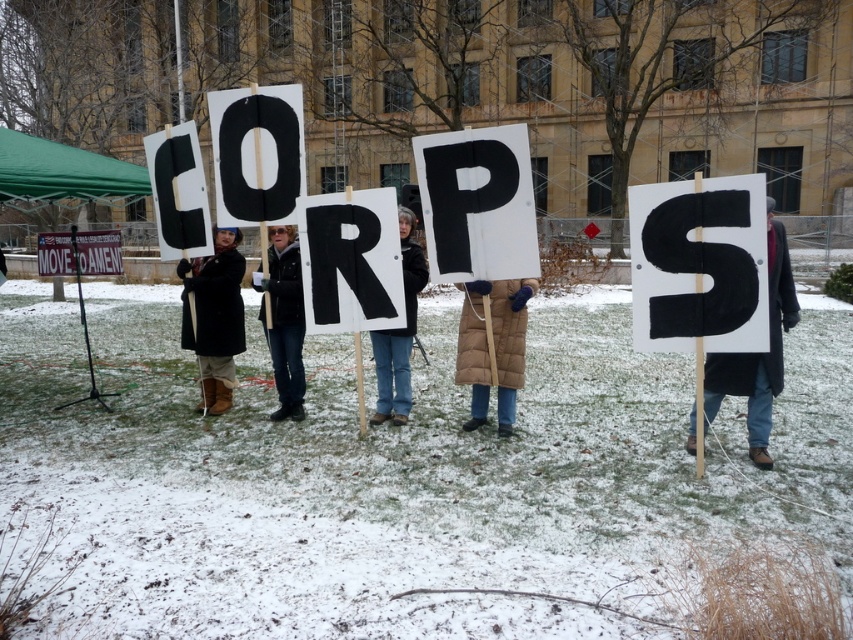
Does black cardboard letter o at center have a greater width compared to white cardboard sign at center?

No.

Can you confirm if black cardboard letter o at center is positioned below white cardboard sign at center?

No, black cardboard letter o at center is not below white cardboard sign at center.

This screenshot has height=640, width=853. Describe the element at coordinates (259, 154) in the screenshot. I see `black cardboard letter o at center` at that location.

This screenshot has width=853, height=640. What are the coordinates of `black cardboard letter o at center` in the screenshot? It's located at (259, 154).

The width and height of the screenshot is (853, 640). I want to click on black felt letter s at right, so click(x=698, y=266).

Does point (677, 316) come farther from viewer compared to point (403, 212)?

No, it is not.

Between point (639, 186) and point (380, 371), which one is positioned in front?

Point (380, 371) is more forward.

Where is `black felt letter s at right`? This screenshot has height=640, width=853. black felt letter s at right is located at coordinates (698, 266).

Which of these two, black cardboard letter p at center or black cardboard letter r at center, stands shorter?

With less height is black cardboard letter p at center.

Who is positioned more to the right, black cardboard letter p at center or black cardboard letter r at center?

black cardboard letter p at center is more to the right.

Is point (498, 168) behind point (352, 212)?

No.

Image resolution: width=853 pixels, height=640 pixels. I want to click on black cardboard letter p at center, so click(477, 204).